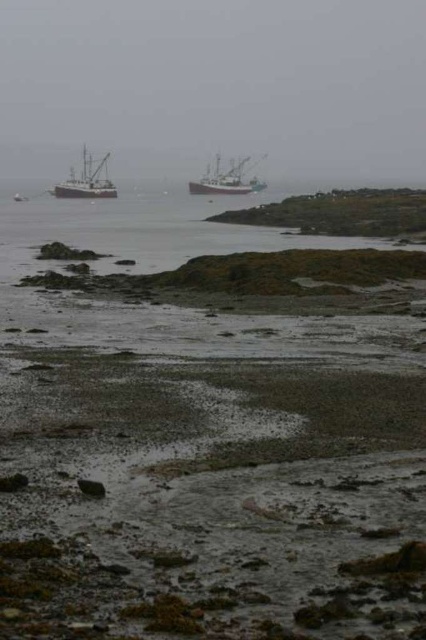
Question: Is metallic gray fishing boat at left behind white wooden ship at center?

Choices:
 (A) no
 (B) yes

Answer: (A)

Question: Does metallic gray fishing boat at left appear under white wooden ship at center?

Choices:
 (A) no
 (B) yes

Answer: (A)

Question: Is metallic gray fishing boat at left to the right of white wooden ship at center from the viewer's perspective?

Choices:
 (A) no
 (B) yes

Answer: (A)

Question: Among these points, which one is farthest from the camera?

Choices:
 (A) (222, 172)
 (B) (103, 164)

Answer: (A)

Question: Which point is closer to the camera?

Choices:
 (A) (189, 184)
 (B) (86, 164)

Answer: (B)